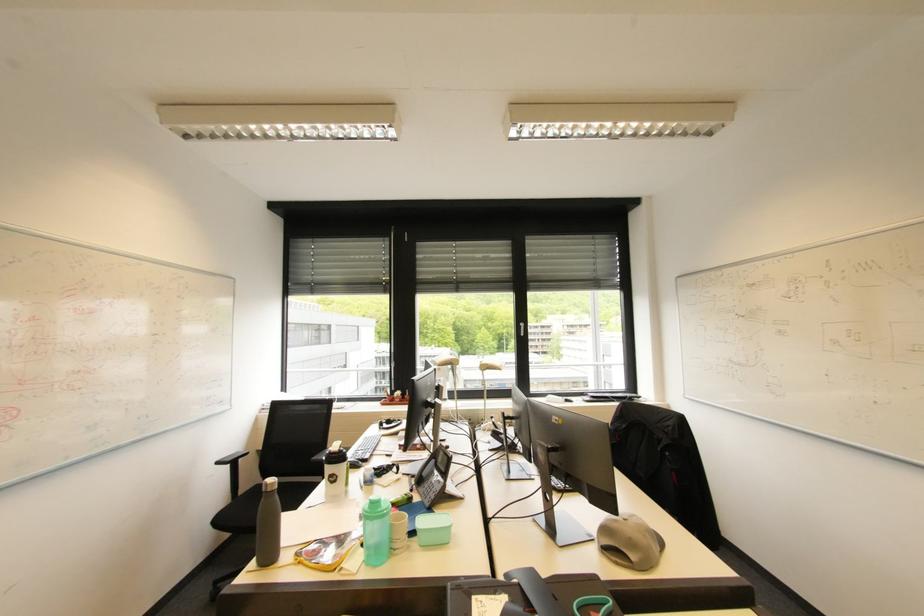
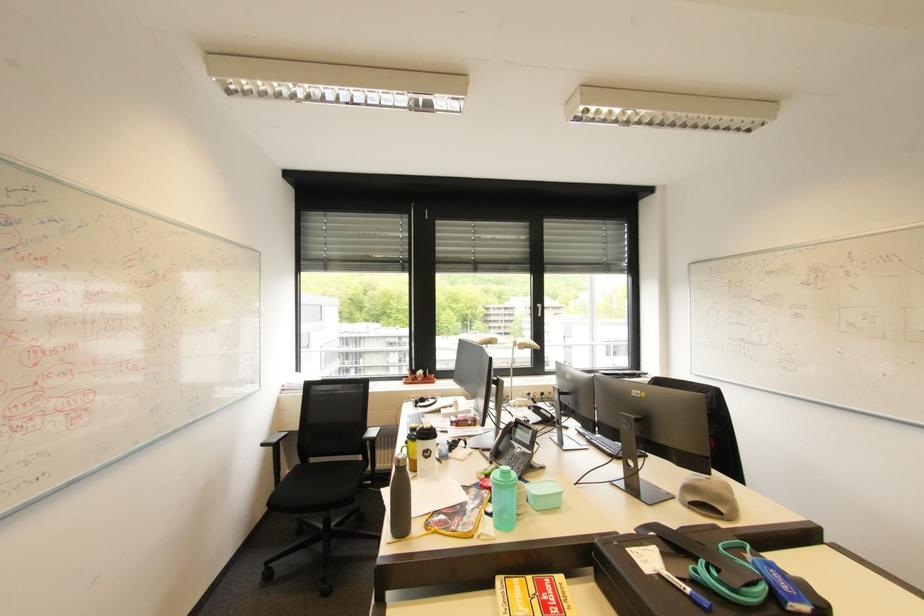
Locate, in the second image, the point that corresponds to point 386,507 in the first image.

(517, 477)